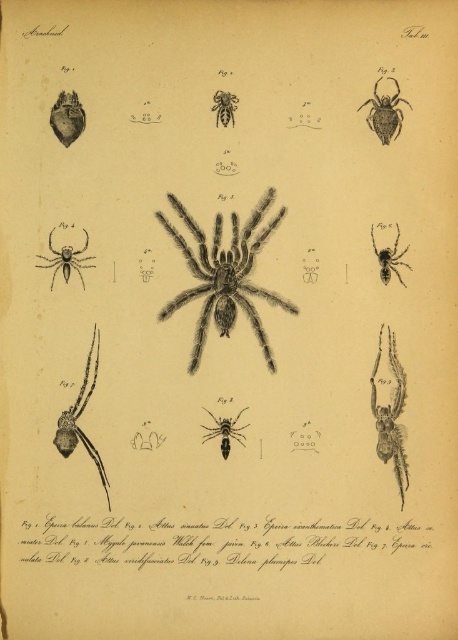
Question: Which of the following is the farthest from the observer?

Choices:
 (A) (58, 268)
 (B) (244, 260)

Answer: (B)

Question: Among these points, which one is farthest from the camera?

Choices:
 (A) (81, 432)
 (B) (210, 260)
 (C) (216, 113)

Answer: (B)

Question: Can you confirm if shiny metallic spider at right is positioned above shiny metallic spider at upper right?

Choices:
 (A) no
 (B) yes

Answer: (A)

Question: Which object is the farthest from the shiny metallic spider at right?

Choices:
 (A) black fuzzy spider at center
 (B) shiny metallic spider at upper right

Answer: (A)

Question: Is black fuzzy spider at center to the right of shiny metallic spider at upper right from the viewer's perspective?

Choices:
 (A) yes
 (B) no

Answer: (B)

Question: Is gray textured spider at center closer to camera compared to shiny metallic spider at lower left?

Choices:
 (A) yes
 (B) no

Answer: (B)